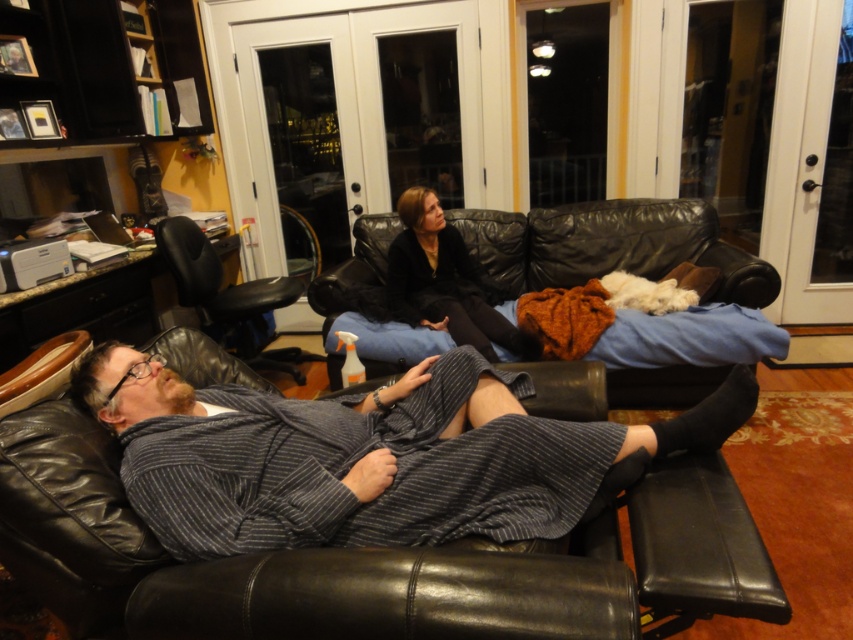
Between black leather couch at center and matte black leather couch at center, which one appears on the left side from the viewer's perspective?

Positioned to the left is matte black leather couch at center.

Can you confirm if black leather couch at center is shorter than matte black leather couch at center?

Indeed, black leather couch at center has a lesser height compared to matte black leather couch at center.

Which is behind, point (688, 228) or point (387, 291)?

Positioned behind is point (688, 228).

This screenshot has height=640, width=853. Find the location of `black leather couch at center`. black leather couch at center is located at coordinates (610, 244).

Is point (421, 225) less distant than point (161, 227)?

Yes, it is.

Is matte black leather couch at center to the right of black leather chair at left from the viewer's perspective?

Indeed, matte black leather couch at center is positioned on the right side of black leather chair at left.

Is point (474, 291) positioned after point (180, 244)?

That is False.

Image resolution: width=853 pixels, height=640 pixels. I want to click on matte black leather couch at center, so coord(445,282).

Locate an element on the screen. striped wool robe at lower left is located at coordinates (370, 456).

Is point (303, 468) more distant than point (587, 252)?

That is False.

Is point (729, 384) positioned after point (554, 272)?

No, it is in front of (554, 272).

You are a GUI agent. You are given a task and a screenshot of the screen. Output one action in this format:
    pyautogui.click(x=<x>, y=<y>)
    Task: Click on the striped wool robe at lower left
    
    Given the screenshot: What is the action you would take?
    pyautogui.click(x=370, y=456)